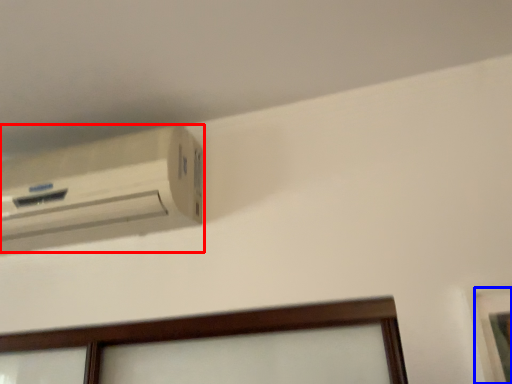
Question: Which object appears closest to the camera in this image, air conditioning (highlighted by a red box) or picture frame (highlighted by a blue box)?

Choices:
 (A) air conditioning
 (B) picture frame

Answer: (B)